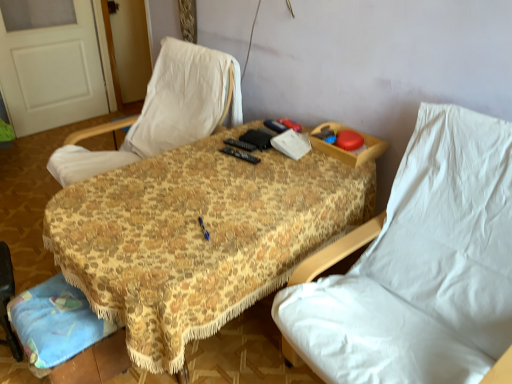
Locate an element on the screen. vacant point above floral fabric table at center (from a real-world perspective) is located at coordinates pyautogui.click(x=214, y=190).